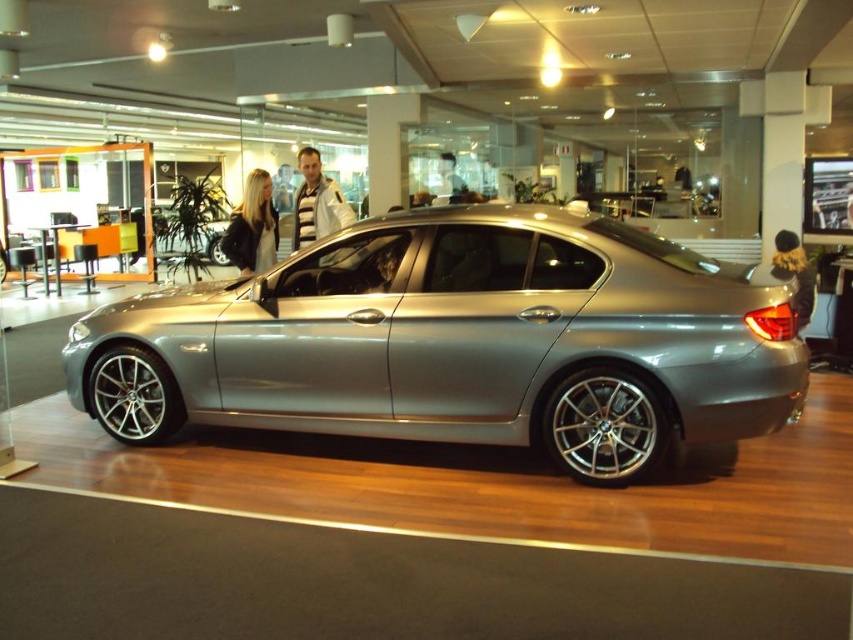
Based on the photo, you are a photographer setting up a shoot in the showroom. You need to decide which object, the satin metallic car at center or the velvet gold jacket at center, requires more space to capture in a closeup shot. Based on their sizes, which one would you prioritize positioning first?

The satin metallic car at center is larger in size than the velvet gold jacket at center, so it requires more space. You should prioritize positioning the satin metallic car at center first to accommodate its size for the closeup shot.

You are standing in the showroom and want to place a striped sweater at center on the silver BMW sedan. Based on the car positioning and the sweater location, can you determine if the sweater will fit on the car without overlapping the taillights?

The striped sweater at center is located at point coordinates that are not overlapping with the taillights area of the silver BMW sedan, so it can be placed there without overlapping the taillights.

You are a customer in a car dealership and see the satin metallic car at center and the striped sweater at center. Which object takes up more space in the showroom?

The satin metallic car at center is bigger than the striped sweater at center, so it takes up more space in the showroom.